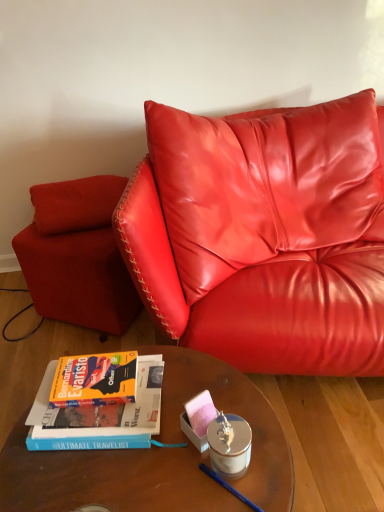
The image size is (384, 512). In order to click on free space above hardcover book at lower left (from a real-world perspective) in this screenshot , I will do `click(96, 379)`.